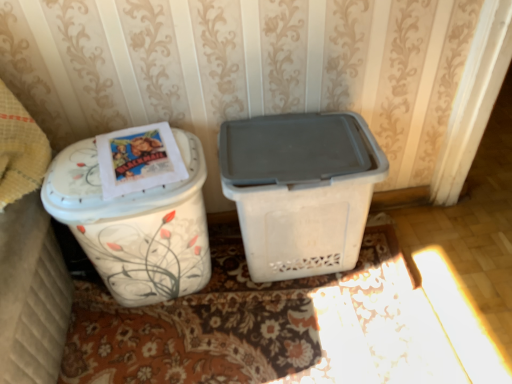
Question: Does floral-patterned carpet at lower center have a greater height compared to white plastic bin at center, acting as the second waste container starting from the left?

Choices:
 (A) yes
 (B) no

Answer: (B)

Question: Is floral-patterned carpet at lower center next to white plastic bin at center, the first waste container when ordered from right to left?

Choices:
 (A) no
 (B) yes

Answer: (A)

Question: From a real-world perspective, is floral-patterned carpet at lower center beneath white plastic bin at center, the first waste container when ordered from right to left?

Choices:
 (A) no
 (B) yes

Answer: (B)

Question: Is floral-patterned carpet at lower center oriented towards white plastic bin at center, acting as the second waste container starting from the left?

Choices:
 (A) no
 (B) yes

Answer: (A)

Question: From the image's perspective, is floral-patterned carpet at lower center over white plastic bin at center, acting as the second waste container starting from the left?

Choices:
 (A) yes
 (B) no

Answer: (B)

Question: Is floral-patterned carpet at lower center bigger than white plastic bin at center, acting as the second waste container starting from the left?

Choices:
 (A) no
 (B) yes

Answer: (A)

Question: Does white floral-patterned container at left have a greater height compared to white floral-patterned trash can at left, the 1th waste container viewed from the left?

Choices:
 (A) no
 (B) yes

Answer: (B)

Question: Could you tell me if white floral-patterned container at left is turned towards white floral-patterned trash can at left, the 1th waste container viewed from the left?

Choices:
 (A) no
 (B) yes

Answer: (A)

Question: Is white floral-patterned container at left beside white floral-patterned trash can at left, which ranks as the second waste container in right-to-left order?

Choices:
 (A) yes
 (B) no

Answer: (B)

Question: Is white floral-patterned trash can at left, which ranks as the second waste container in right-to-left order, at the back of white floral-patterned container at left?

Choices:
 (A) yes
 (B) no

Answer: (B)

Question: Would you consider white floral-patterned container at left to be distant from white floral-patterned trash can at left, which ranks as the second waste container in right-to-left order?

Choices:
 (A) yes
 (B) no

Answer: (B)

Question: Does white floral-patterned container at left have a greater width compared to white floral-patterned trash can at left, the 1th waste container viewed from the left?

Choices:
 (A) yes
 (B) no

Answer: (A)

Question: Is floral-patterned carpet at lower center bigger than white floral-patterned trash can at left, which ranks as the second waste container in right-to-left order?

Choices:
 (A) no
 (B) yes

Answer: (A)